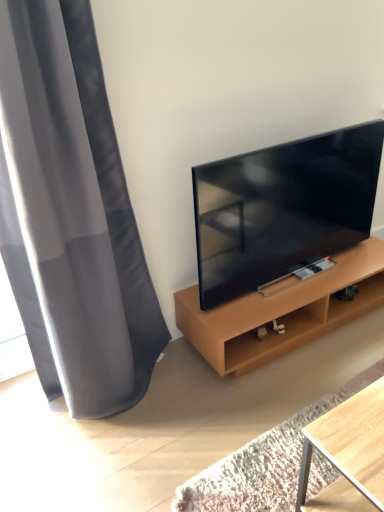
Where is `free region under matte black tv at right (from a real-world perspective)`? The width and height of the screenshot is (384, 512). free region under matte black tv at right (from a real-world perspective) is located at coordinates (259, 288).